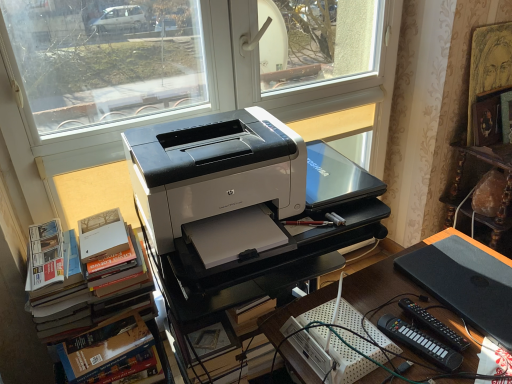
Where is `vacant area that lies to the right of black plastic remote control at lower right, positioned as the second equipment in right-to-left order`? This screenshot has width=512, height=384. vacant area that lies to the right of black plastic remote control at lower right, positioned as the second equipment in right-to-left order is located at coordinates (471, 345).